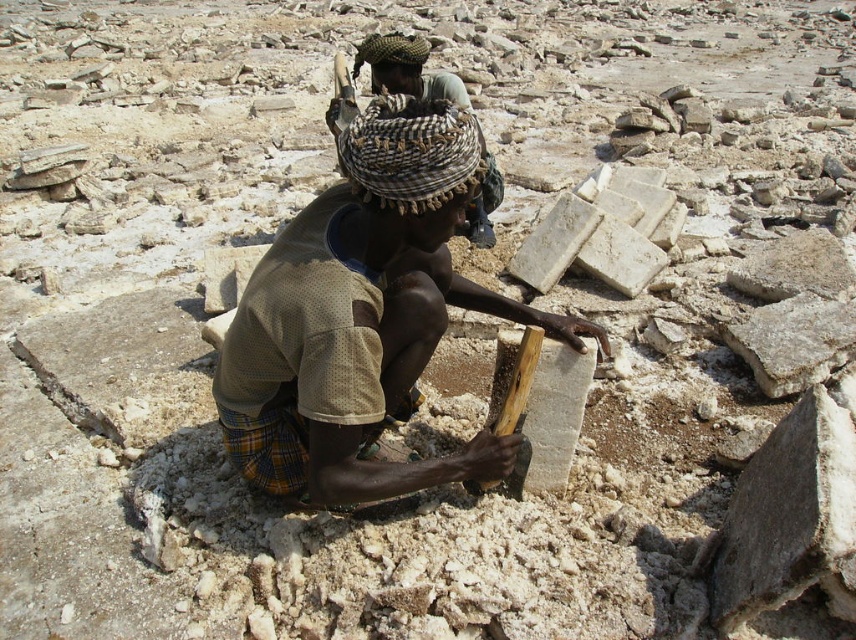
Does point (294, 451) come farther from viewer compared to point (385, 81)?

No, (294, 451) is closer to viewer.

Does brown wood at center have a lesser height compared to brown woven scarf at center?

In fact, brown wood at center may be taller than brown woven scarf at center.

Between point (319, 445) and point (391, 60), which one is positioned in front?

Point (319, 445) is more forward.

Image resolution: width=856 pixels, height=640 pixels. Find the location of `brown wood at center`. brown wood at center is located at coordinates (363, 316).